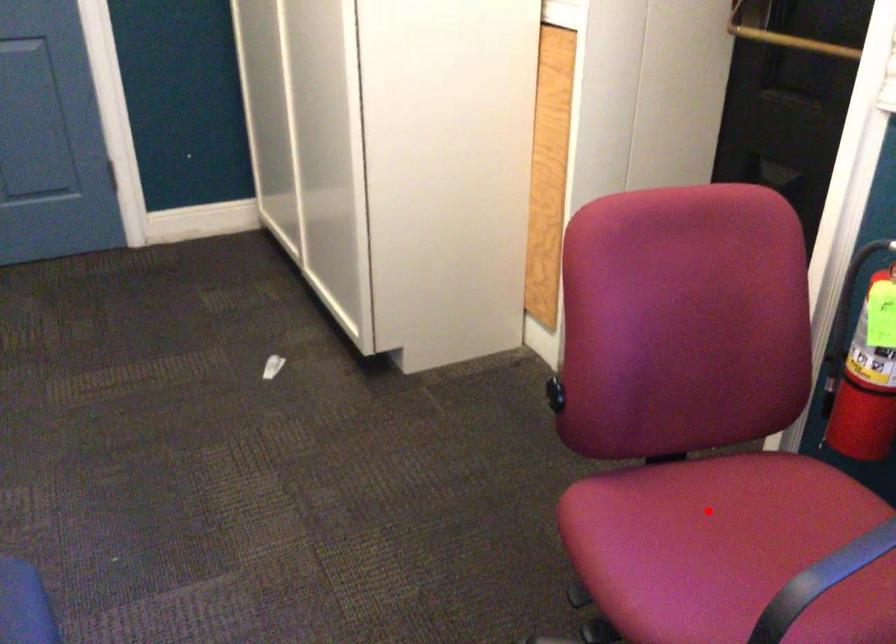
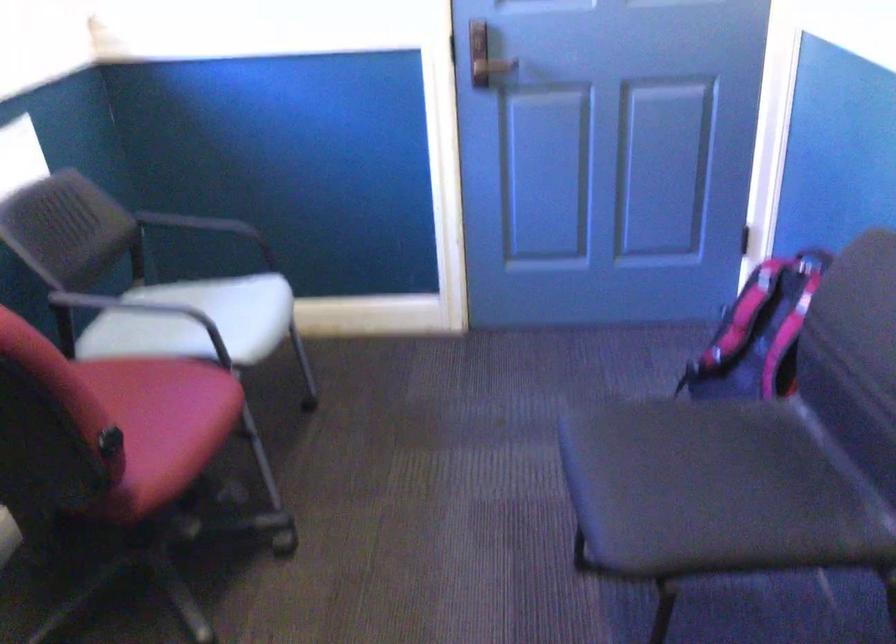
Question: I am providing you with two images of the same scene from different viewpoints. A red point is marked on the first image. Is the red point's position out of view in image 2?

Choices:
 (A) Yes
 (B) No

Answer: (A)